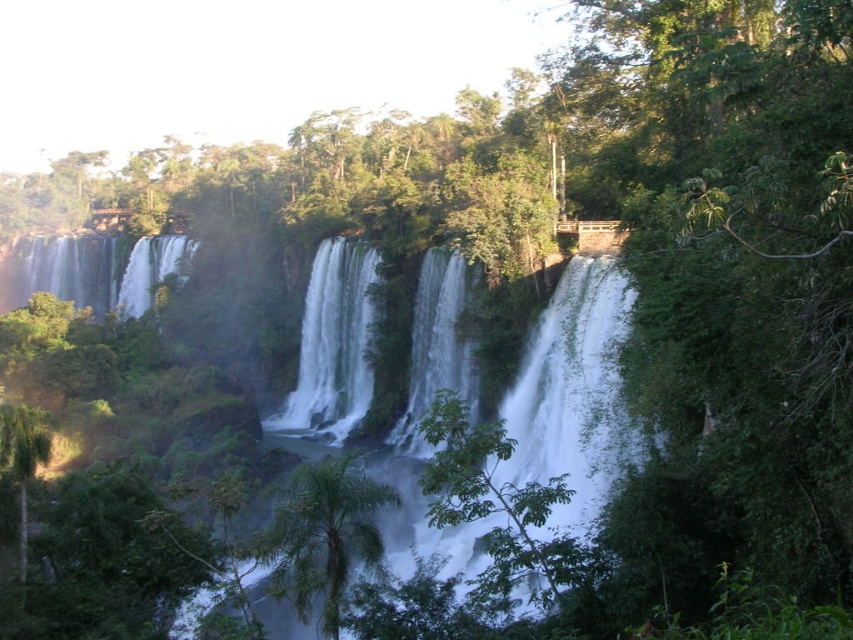
You are a hiker standing at the base of the waterfall and want to take a photo of both the green leafy tree at center and the green leafy palm tree at center. Which tree should you position closer to the camera to include both in the frame without cropping?

To include both the green leafy tree at center and the green leafy palm tree at center in the frame without cropping, you should position the green leafy palm tree at center closer to the camera since it is shorter than the green leafy tree at center.

You are standing at the base of the waterfall and want to take a photo of the two points mentioned. Which point is closer to you, point (521, 492) or point (340, 513)?

Point (521, 492) is in front of point (340, 513), so it is closer to you.